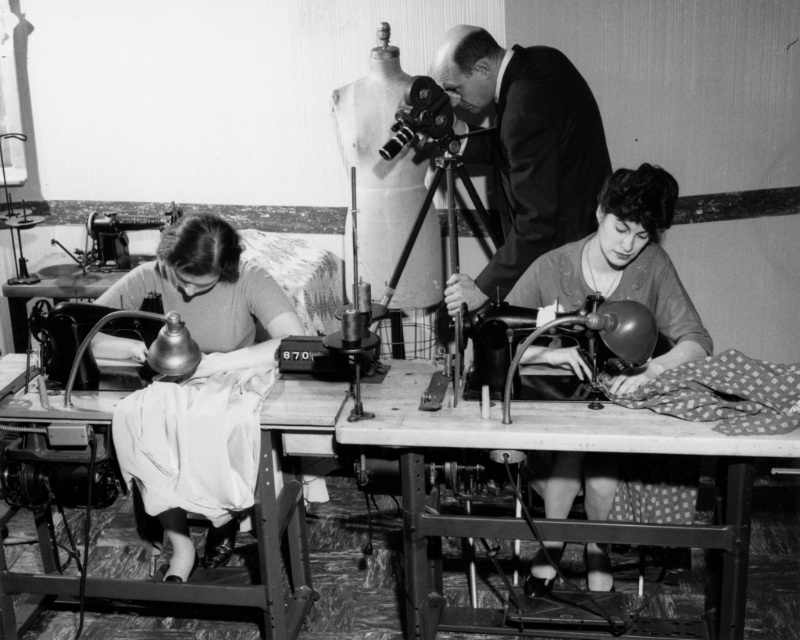
Between point (616, 433) and point (124, 216), which one is positioned in front?

Point (616, 433) is more forward.

Who is higher up, wooden table at center or metallic sewing machine at left?

metallic sewing machine at left is above.

Is point (370, 436) farther from viewer compared to point (126, 221)?

No, it is in front of (126, 221).

Image resolution: width=800 pixels, height=640 pixels. Identify the location of wooden table at center. (562, 449).

Describe the element at coordinates (562, 449) in the screenshot. This screenshot has height=640, width=800. I see `wooden table at center` at that location.

Which is in front, point (720, 589) or point (626, 216)?

Point (626, 216) is more forward.

Does point (404, 444) come behind point (554, 484)?

No, (404, 444) is in front of (554, 484).

This screenshot has width=800, height=640. Find the location of `wooden table at center`. wooden table at center is located at coordinates (562, 449).

Is the position of matte white fabric at left less distant than that of metallic sewing machine at left?

That is True.

Can you confirm if matte white fabric at left is smaller than metallic sewing machine at left?

No, matte white fabric at left is not smaller than metallic sewing machine at left.

Find the location of a particular element. matte white fabric at left is located at coordinates click(x=202, y=385).